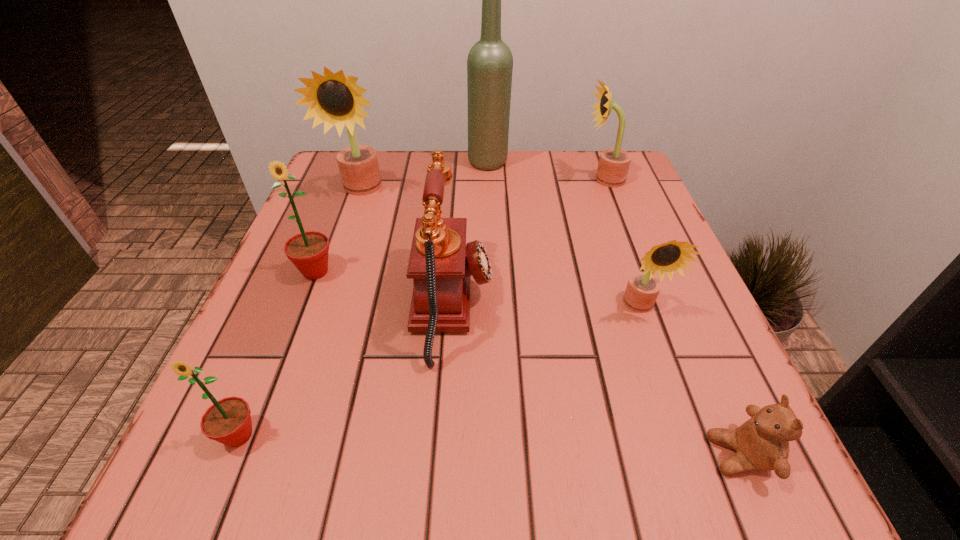
Where is `free space located on the dial of the telephone`? free space located on the dial of the telephone is located at coordinates (698, 306).

Image resolution: width=960 pixels, height=540 pixels. I want to click on vacant space situated on the face of the nearest yellow sunflower, so click(x=679, y=417).

Image resolution: width=960 pixels, height=540 pixels. In order to click on vacant region located 0.060m on the face of the nearer green sunflower in this screenshot , I will do `click(210, 505)`.

Image resolution: width=960 pixels, height=540 pixels. Find the location of `free space located on the face of the teddy bear`. free space located on the face of the teddy bear is located at coordinates (583, 455).

Where is `vacant space located 0.130m on the face of the teddy bear`? vacant space located 0.130m on the face of the teddy bear is located at coordinates (612, 455).

Find the location of a particular element. Image resolution: width=960 pixels, height=540 pixels. vacant area located on the face of the teddy bear is located at coordinates (461, 455).

Identify the location of wine bottle at the far edge. (490, 62).

Where is `sunflower present at the near edge`? sunflower present at the near edge is located at coordinates (228, 421).

Locate an element on the screen. This screenshot has height=540, width=960. teddy bear present at the near edge is located at coordinates (761, 443).

Where is `teddy bear situated at the right edge`? Image resolution: width=960 pixels, height=540 pixels. teddy bear situated at the right edge is located at coordinates (761, 443).